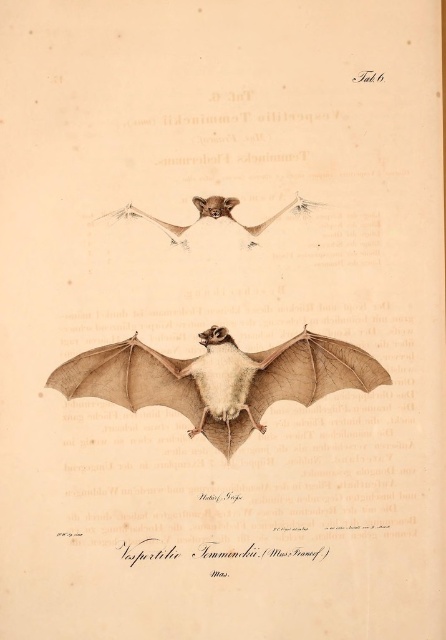
Question: Which of the following is the farthest from the observer?

Choices:
 (A) [x=131, y=344]
 (B) [x=248, y=243]

Answer: (B)

Question: Which object is closer to the camera taking this photo?

Choices:
 (A) brown textured wing at center
 (B) brown textured bat at center

Answer: (A)

Question: Which of the following is the farthest from the observer?

Choices:
 (A) brown textured bat at center
 (B) brown textured wing at center

Answer: (A)

Question: Is brown textured wing at center in front of brown textured bat at center?

Choices:
 (A) no
 (B) yes

Answer: (B)

Question: Can you confirm if brown textured wing at center is positioned to the left of brown textured bat at center?

Choices:
 (A) yes
 (B) no

Answer: (B)

Question: Can you confirm if brown textured wing at center is positioned to the right of brown textured bat at center?

Choices:
 (A) yes
 (B) no

Answer: (A)